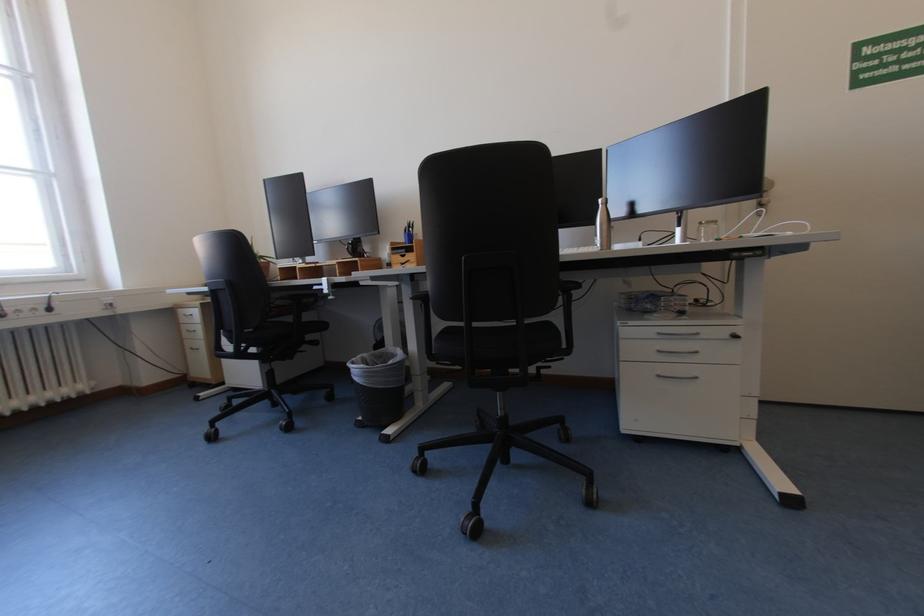
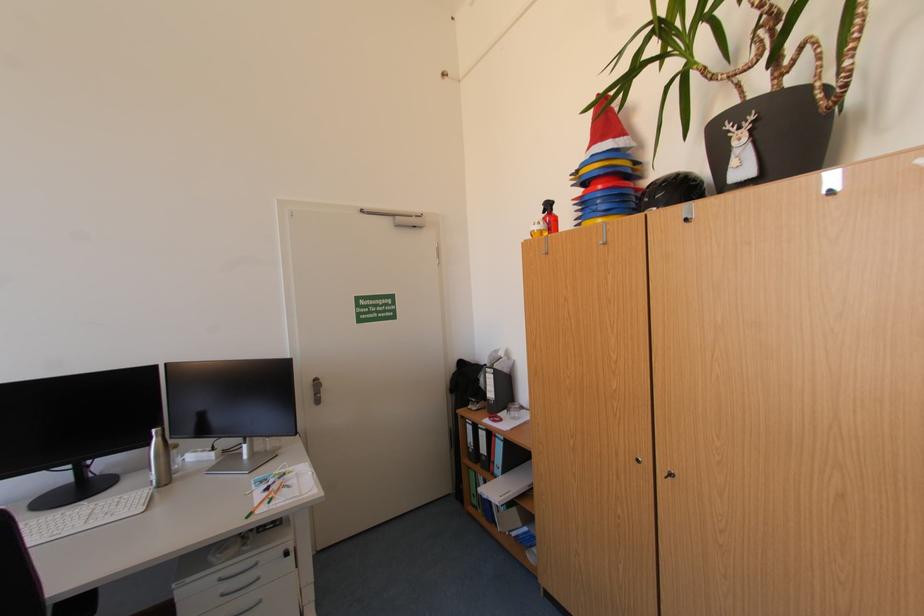
Locate, in the second image, the point that corresponds to point 608,152 in the first image.

(164, 368)